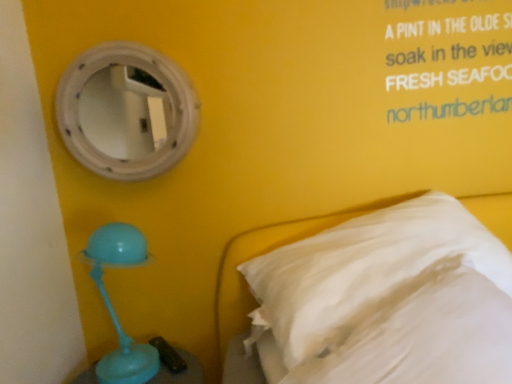
Question: From the image's perspective, is white soft pillow at right positioned above or below white wooden mirror at upper left?

Choices:
 (A) below
 (B) above

Answer: (A)

Question: Choose the correct answer: Is white soft pillow at right inside white wooden mirror at upper left or outside it?

Choices:
 (A) outside
 (B) inside

Answer: (A)

Question: Is white soft pillow at right taller or shorter than white wooden mirror at upper left?

Choices:
 (A) tall
 (B) short

Answer: (A)

Question: Considering the positions of white wooden mirror at upper left and white soft pillow at right in the image, is white wooden mirror at upper left wider or thinner than white soft pillow at right?

Choices:
 (A) thin
 (B) wide

Answer: (A)

Question: Is point (105, 92) closer or farther from the camera than point (303, 357)?

Choices:
 (A) closer
 (B) farther

Answer: (B)

Question: In the image, is white wooden mirror at upper left positioned in front of or behind white soft pillow at right?

Choices:
 (A) behind
 (B) front

Answer: (A)

Question: From their relative heights in the image, would you say white wooden mirror at upper left is taller or shorter than white soft pillow at right?

Choices:
 (A) tall
 (B) short

Answer: (B)